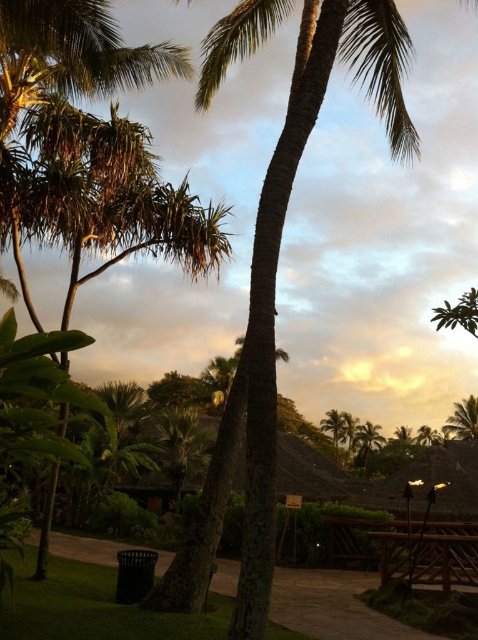
Question: Observing the image, what is the correct spatial positioning of green textured palm tree at center in reference to green leafy palm tree at lower right?

Choices:
 (A) left
 (B) right

Answer: (A)

Question: Does brown wooden path at lower center have a larger size compared to green leafy palm tree at center?

Choices:
 (A) yes
 (B) no

Answer: (A)

Question: Which point is farther to the camera?

Choices:
 (A) (303, 620)
 (B) (473, 397)
 (C) (436, 577)
 (D) (198, 532)

Answer: (B)

Question: Estimate the real-world distances between objects in this image. Which object is closer to the brown wooden picnic table at lower right?

Choices:
 (A) green leafy palm tree at lower right
 (B) brown wooden path at lower center
 (C) green leafy palm tree at center

Answer: (B)

Question: Can you confirm if brown wooden path at lower center is positioned below brown wooden picnic table at lower right?

Choices:
 (A) no
 (B) yes

Answer: (B)

Question: Among these points, which one is nearest to the camera?

Choices:
 (A) (448, 433)
 (B) (366, 428)

Answer: (A)